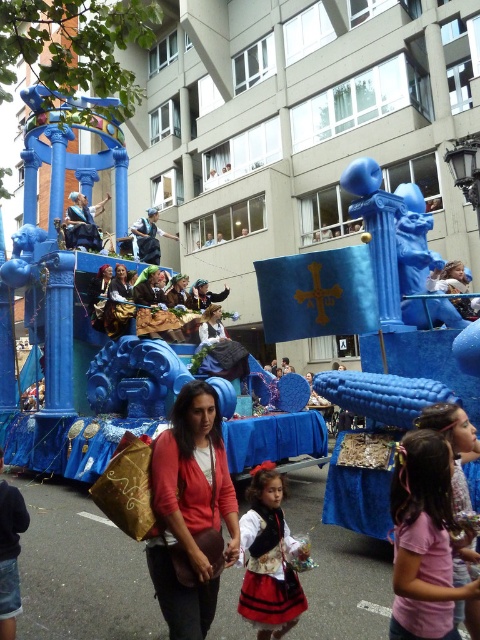
Is point (192, 401) positioned before point (405, 566)?

No, it is not.

Can you confirm if matte red sweater at center is taller than pink fabric dress at lower center?

Correct, matte red sweater at center is much taller as pink fabric dress at lower center.

What are the coordinates of `matte red sweater at center` in the screenshot? It's located at (191, 508).

Which is more to the left, pink fabric dress at lower center or matte gold dress at center?

matte gold dress at center is more to the left.

Which is above, pink fabric dress at lower center or matte gold dress at center?

matte gold dress at center

Which is behind, point (440, 536) or point (120, 304)?

Point (120, 304)

Where is `pink fabric dress at lower center`? This screenshot has height=640, width=480. pink fabric dress at lower center is located at coordinates (423, 540).

The height and width of the screenshot is (640, 480). What do you see at coordinates (423, 540) in the screenshot?
I see `pink fabric dress at lower center` at bounding box center [423, 540].

Which is in front, point (433, 468) or point (267, 598)?

Point (433, 468)

Where is `pink fabric dress at lower center`? Image resolution: width=480 pixels, height=640 pixels. pink fabric dress at lower center is located at coordinates (423, 540).